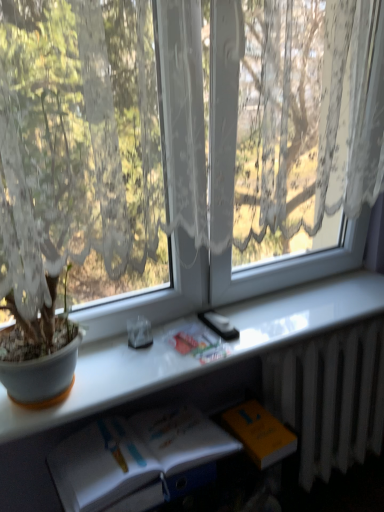
Question: From a real-world perspective, is transparent lace curtain at upper center below orange matte paperback book at lower right?

Choices:
 (A) no
 (B) yes

Answer: (A)

Question: From the image's perspective, does transparent lace curtain at upper center appear lower than orange matte paperback book at lower right?

Choices:
 (A) no
 (B) yes

Answer: (A)

Question: Can you confirm if transparent lace curtain at upper center is taller than orange matte paperback book at lower right?

Choices:
 (A) yes
 (B) no

Answer: (A)

Question: Does transparent lace curtain at upper center appear on the left side of orange matte paperback book at lower right?

Choices:
 (A) no
 (B) yes

Answer: (B)

Question: Considering the relative sizes of transparent lace curtain at upper center and orange matte paperback book at lower right in the image provided, is transparent lace curtain at upper center shorter than orange matte paperback book at lower right?

Choices:
 (A) no
 (B) yes

Answer: (A)

Question: Can you confirm if transparent lace curtain at upper center is positioned to the right of orange matte paperback book at lower right?

Choices:
 (A) yes
 (B) no

Answer: (B)

Question: Is white glossy book at lower center taller than white paper book at lower center, acting as the 1th book starting from the bottom?

Choices:
 (A) no
 (B) yes

Answer: (A)

Question: Does white glossy book at lower center have a lesser height compared to white paper book at lower center, positioned as the second book in top-to-bottom order?

Choices:
 (A) no
 (B) yes

Answer: (B)

Question: Is white glossy book at lower center at the left side of white paper book at lower center, acting as the 1th book starting from the bottom?

Choices:
 (A) yes
 (B) no

Answer: (B)

Question: Does white glossy book at lower center have a lesser width compared to white paper book at lower center, positioned as the second book in top-to-bottom order?

Choices:
 (A) no
 (B) yes

Answer: (A)

Question: From a real-world perspective, is white glossy book at lower center on white paper book at lower center, positioned as the second book in top-to-bottom order?

Choices:
 (A) no
 (B) yes

Answer: (B)

Question: From the image's perspective, does white glossy book at lower center appear higher than white paper book at lower center, positioned as the second book in top-to-bottom order?

Choices:
 (A) no
 (B) yes

Answer: (B)

Question: Would you say transparent lace curtain at upper center contains white metallic radiator at lower right?

Choices:
 (A) no
 (B) yes

Answer: (A)